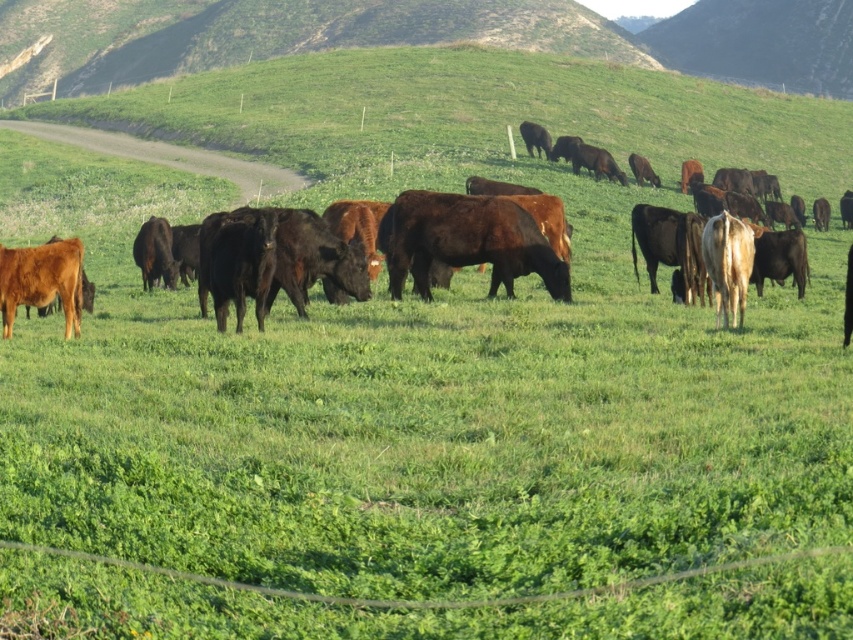
Does brown glossy cows at center have a greater width compared to brown glossy cow at lower left?

Correct, the width of brown glossy cows at center exceeds that of brown glossy cow at lower left.

How distant is brown glossy cows at center from brown glossy cow at lower left?

They are 49.17 feet apart.

Locate an element on the screen. This screenshot has height=640, width=853. brown glossy cows at center is located at coordinates (170, 156).

Does brown glossy bull at center lie behind brown glossy cows at center?

Yes.

Looking at this image, is brown glossy bull at center shorter than brown glossy cows at center?

Yes.

Locate an element on the screen. The width and height of the screenshot is (853, 640). brown glossy bull at center is located at coordinates (468, 241).

Is brown glossy bull at center to the right of brown glossy cow at lower left from the viewer's perspective?

Correct, you'll find brown glossy bull at center to the right of brown glossy cow at lower left.

Does point (461, 225) come behind point (65, 275)?

Yes, it is.

At what (x,y) coordinates should I click in order to perform the action: click on brown glossy bull at center. Please return your answer as a coordinate pair (x, y). This screenshot has height=640, width=853. Looking at the image, I should click on (468, 241).

This screenshot has height=640, width=853. Identify the location of brown glossy bull at center. (468, 241).